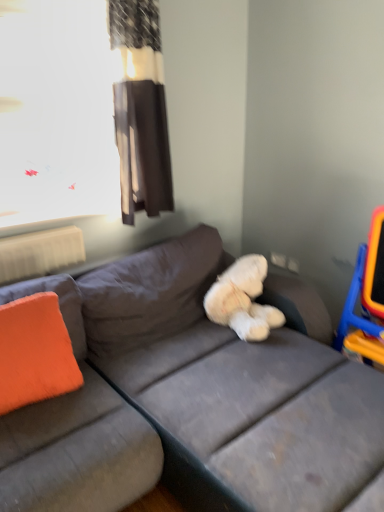
Question: Can you confirm if gray fabric couch at center is positioned to the left of orange plastic swivel chair at right?

Choices:
 (A) yes
 (B) no

Answer: (A)

Question: Does gray fabric couch at center have a greater width compared to orange plastic swivel chair at right?

Choices:
 (A) no
 (B) yes

Answer: (B)

Question: Is gray fabric couch at center further to the viewer compared to orange plastic swivel chair at right?

Choices:
 (A) no
 (B) yes

Answer: (A)

Question: From a real-world perspective, is gray fabric couch at center positioned over orange plastic swivel chair at right based on gravity?

Choices:
 (A) no
 (B) yes

Answer: (A)

Question: Considering the relative sizes of gray fabric couch at center and orange plastic swivel chair at right in the image provided, is gray fabric couch at center thinner than orange plastic swivel chair at right?

Choices:
 (A) yes
 (B) no

Answer: (B)

Question: In terms of height, does gray fabric couch at center look taller or shorter compared to orange fabric pillow at left?

Choices:
 (A) short
 (B) tall

Answer: (B)

Question: From a real-world perspective, is gray fabric couch at center physically located above or below orange fabric pillow at left?

Choices:
 (A) below
 (B) above

Answer: (A)

Question: Considering the positions of gray fabric couch at center and orange fabric pillow at left in the image, is gray fabric couch at center bigger or smaller than orange fabric pillow at left?

Choices:
 (A) small
 (B) big

Answer: (B)

Question: Visually, is gray fabric couch at center positioned to the left or to the right of orange fabric pillow at left?

Choices:
 (A) right
 (B) left

Answer: (A)

Question: Is orange fabric pillow at left inside or outside of brown fabric curtain at upper center?

Choices:
 (A) inside
 (B) outside

Answer: (B)

Question: Considering the positions of point (59, 361) and point (132, 181), is point (59, 361) closer or farther from the camera than point (132, 181)?

Choices:
 (A) closer
 (B) farther

Answer: (A)

Question: From the image's perspective, relative to brown fabric curtain at upper center, is orange fabric pillow at left above or below?

Choices:
 (A) below
 (B) above

Answer: (A)

Question: Considering the positions of orange fabric pillow at left and brown fabric curtain at upper center in the image, is orange fabric pillow at left taller or shorter than brown fabric curtain at upper center?

Choices:
 (A) short
 (B) tall

Answer: (A)

Question: Is orange fabric pillow at left taller or shorter than white fluffy teddy bear at center?

Choices:
 (A) short
 (B) tall

Answer: (B)

Question: Would you say orange fabric pillow at left is to the left or to the right of white fluffy teddy bear at center in the picture?

Choices:
 (A) left
 (B) right

Answer: (A)